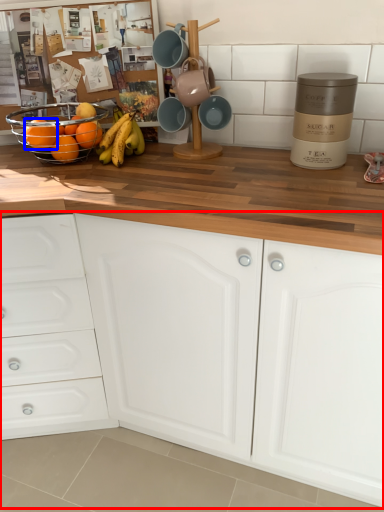
Question: Which object is closer to the camera taking this photo, cabinetry (highlighted by a red box) or orange (highlighted by a blue box)?

Choices:
 (A) cabinetry
 (B) orange

Answer: (A)